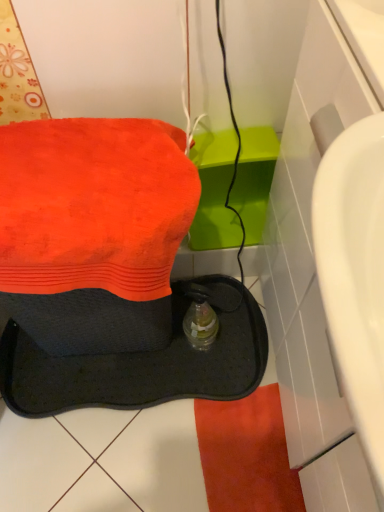
Question: Is point (29, 152) positioned closer to the camera than point (132, 266)?

Choices:
 (A) farther
 (B) closer

Answer: (A)

Question: In terms of size, does black rubber sink at lower left appear bigger or smaller than orange terry towel at upper left?

Choices:
 (A) big
 (B) small

Answer: (A)

Question: Based on their relative distances, which object is nearer to the orange terry towel at upper left?

Choices:
 (A) translucent plastic bottle at center
 (B) black rubber sink at lower left

Answer: (A)

Question: Which is nearer to the black rubber sink at lower left?

Choices:
 (A) orange terry towel at upper left
 (B) translucent plastic bottle at center

Answer: (B)